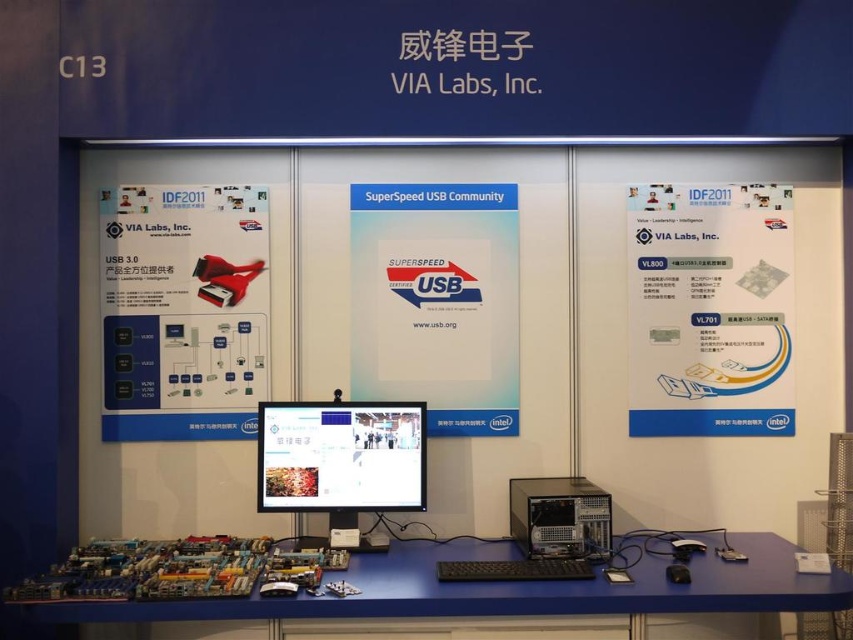
You are at the technology conference and need to set up your laptop on the blue plastic computer desk at lower left. From your current position at the entrance, which direction should you move to reach the desk?

Since the blue plastic computer desk at lower left is located at point (509, 589), you should move towards the lower left direction to reach it from the entrance.

You are a conference attendee standing at the entrance of the booth. You want to sit down at the blue plastic computer desk at lower left to try out a demo. However, you need to pass by the matte black monitor at center. Given that the distance between them is 16.04 inches, can you walk through the space between them without touching either?

The blue plastic computer desk at lower left and the matte black monitor at center are 16.04 inches apart from each other. Since 16.04 inches is approximately 1.34 feet, it is very tight and likely not enough space for a person to walk through comfortably without touching either object. Therefore, it would be difficult to pass through the space between them safely.

You are setting up a presentation at the booth and need to place a new accessory between the matte black monitor at center and the black plastic computer at center. Based on their current positions, where should you place the accessory?

The accessory should be placed between the matte black monitor at center and the black plastic computer at center, aligning it to the right of the matte black monitor at center and to the left of the black plastic computer at center since the matte black monitor is on the left side of the black plastic computer at center.